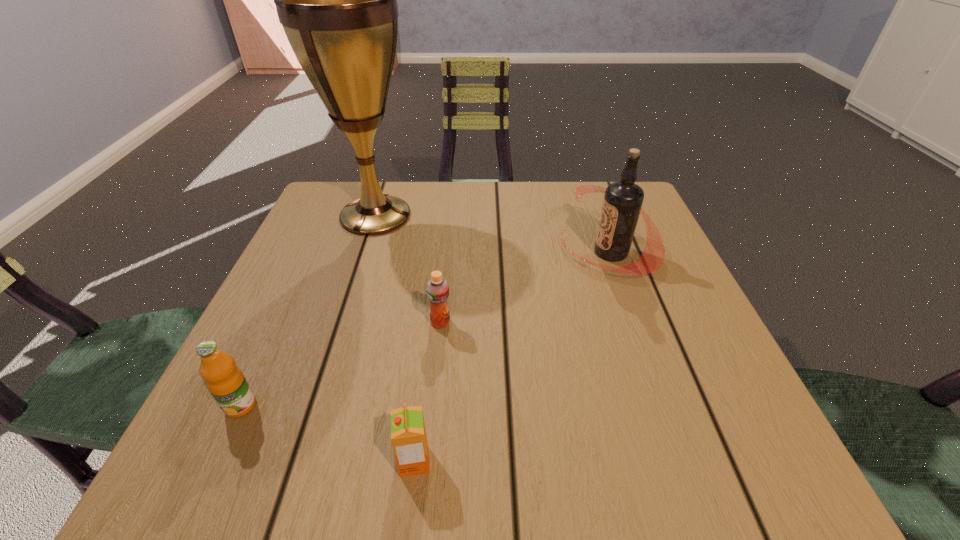
Locate an element on the screen. The width and height of the screenshot is (960, 540). vacant space located on the label of the rightmost object is located at coordinates (491, 252).

The image size is (960, 540). What are the coordinates of `vacant space located on the label of the second farthest orange juice` in the screenshot? It's located at (219, 453).

I want to click on vacant space located on the back of the farthest orange juice, so click(x=448, y=237).

Image resolution: width=960 pixels, height=540 pixels. Identify the location of free location located on the back of the nearest orange juice. (426, 358).

You are a GUI agent. You are given a task and a screenshot of the screen. Output one action in this format:
    pyautogui.click(x=<x>, y=<y>)
    Task: Click on the trophy cup that is at the far edge
    The height and width of the screenshot is (540, 960).
    Given the screenshot: What is the action you would take?
    pyautogui.click(x=337, y=0)

Where is `root beer positioned at the far edge`? The width and height of the screenshot is (960, 540). root beer positioned at the far edge is located at coordinates (622, 203).

In order to click on object that is at the near edge in this screenshot , I will do `click(408, 435)`.

The image size is (960, 540). Find the location of `trophy cup that is positioned at the left edge`. trophy cup that is positioned at the left edge is located at coordinates pyautogui.click(x=337, y=0).

Identify the location of orange juice that is at the left edge. The image size is (960, 540). (226, 382).

This screenshot has height=540, width=960. Find the location of `object situated at the right edge`. object situated at the right edge is located at coordinates (622, 203).